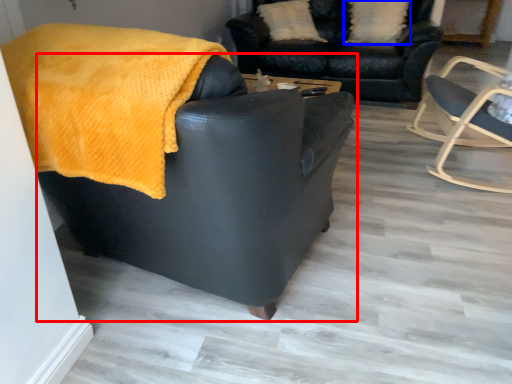
Question: Which point is further to the camera, chair (highlighted by a red box) or pillow (highlighted by a blue box)?

Choices:
 (A) chair
 (B) pillow

Answer: (B)